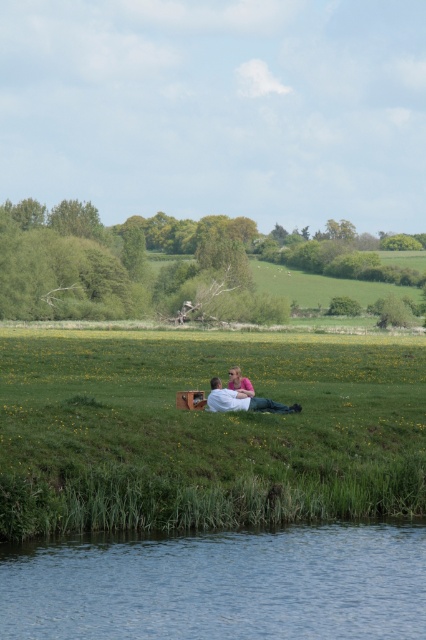
You are standing in the rural scene and want to place a small picnic basket between the green grassy hillside at center and the pink fabric at center. Which object should you place the basket closer to if you want it to appear closer to the viewer?

You should place the picnic basket closer to the green grassy hillside at center because it is closer to the viewer than the pink fabric at center, so positioning the basket near it will make it appear closer.

You are planning to set up a picnic blanket in the scene. The picnic blanket is 3 meters wide. Which area between the green grassy hillside at center and the blue water at lower center can accommodate the blanket without overlapping either of them?

The green grassy hillside at center has a greater width than the blue water at lower center. Therefore, the picnic blanket can be placed on the green grassy hillside at center since its width is sufficient to accommodate the 3 meter wide blanket without overlapping.

You are planning to set up a picnic blanket for two people. You have a picnic blanket that is 1.5 meters wide. The green grassy hillside at center and the white fabric at center are both potential spots. Based on the scene description, which location would be more suitable for placing the picnic blanket?

The green grassy hillside at center is larger in size than the white fabric at center, so it would be more suitable for placing the picnic blanket as it can accommodate the 1.5 meters width comfortably.